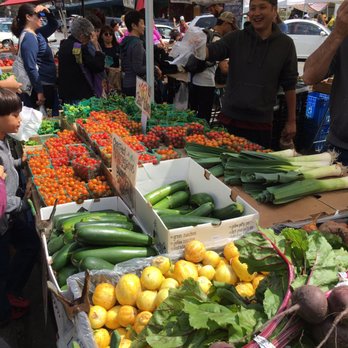
The height and width of the screenshot is (348, 348). Identify the location of cardboard box. (196, 176).